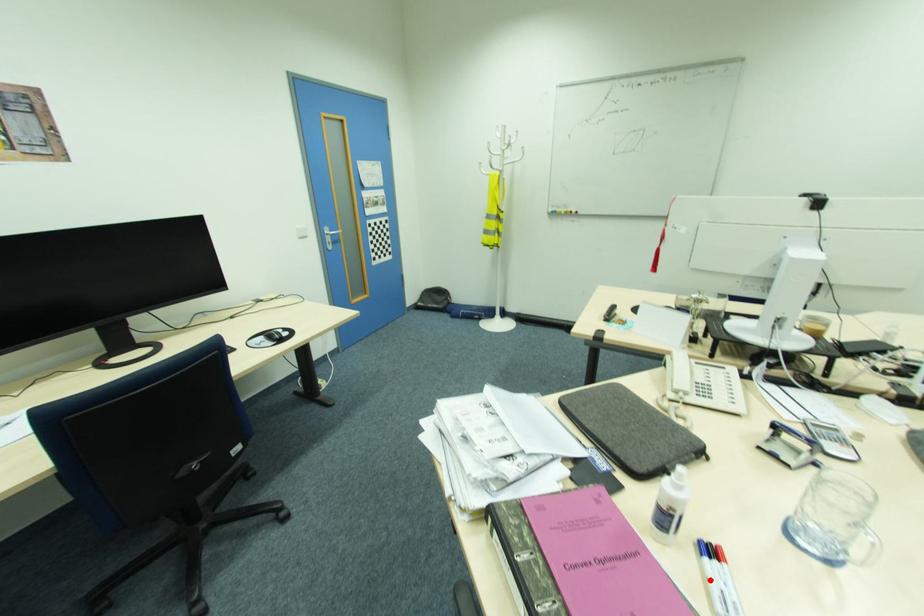
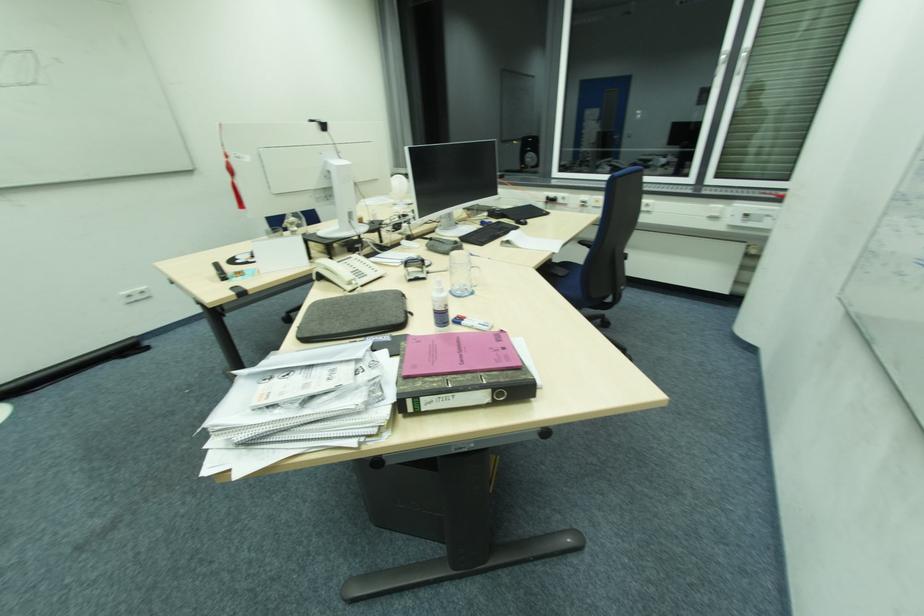
The point at the highlighted location is marked in the first image. Where is the corresponding point in the second image?

(477, 326)